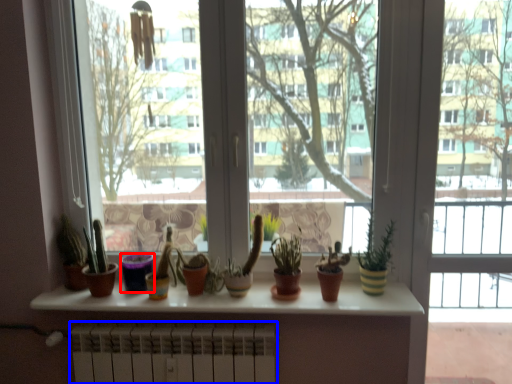
Question: Which of the following is the closest to the observer, flowerpot (highlighted by a red box) or radiator (highlighted by a blue box)?

Choices:
 (A) flowerpot
 (B) radiator

Answer: (B)